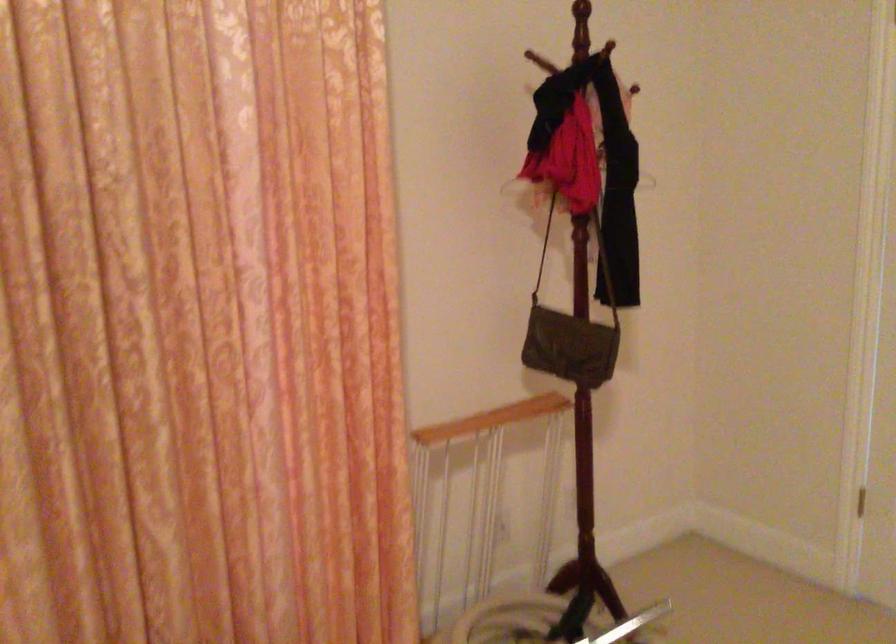
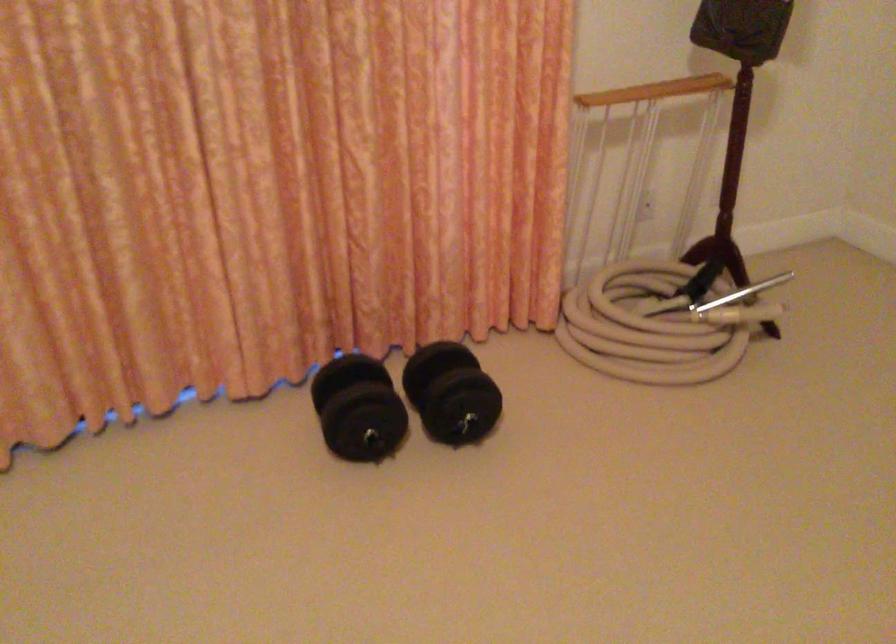
In the second image, find the point that corresponds to [545,401] in the first image.

(711, 78)